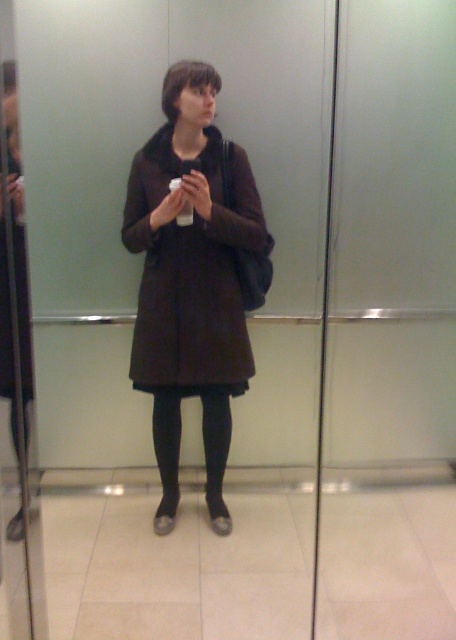
You are an interior designer working on a layout for a small room. The room has limited space, and you need to place a matte brown coat at center. Where exactly should you position it to match the coordinates provided?

The matte brown coat at center should be placed at point coordinates (192, 273) to match the given coordinates.

You are an interior designer observing the scene. You need to determine which object is nearer to the viewer between the matte brown coat at center and the black tights at lower center. Which one is closer?

The matte brown coat at center is closer to the viewer than the black tights at lower center.

You are a fashion designer observing the person in the image. You need to determine which item of clothing takes up more space visually. Which object is larger in size between the matte brown coat at center and the black tights at lower center?

The matte brown coat at center is bigger than the black tights at lower center, so the matte brown coat at center takes up more visual space.